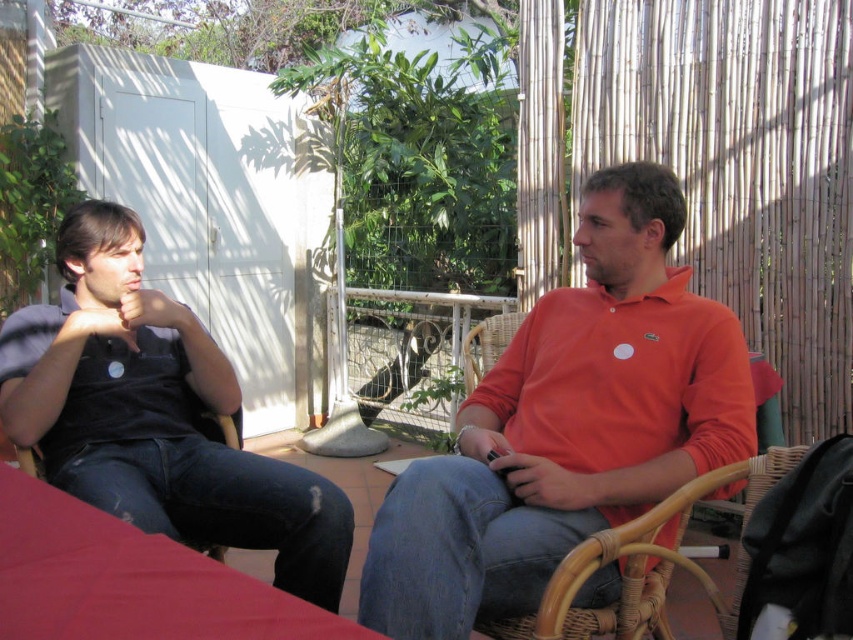
Can you confirm if orange cotton polo shirt at right is positioned to the left of smooth red table at lower left?

No, orange cotton polo shirt at right is not to the left of smooth red table at lower left.

Which is below, orange cotton polo shirt at right or smooth red table at lower left?

smooth red table at lower left is lower down.

This screenshot has height=640, width=853. In order to click on orange cotton polo shirt at right in this screenshot , I will do `click(567, 424)`.

Is smooth red table at lower left above woven rattan chair at right?

Yes, smooth red table at lower left is above woven rattan chair at right.

Is point (28, 540) farther from camera compared to point (711, 593)?

No, it is in front of (711, 593).

At what (x,y) coordinates should I click in order to perform the action: click on smooth red table at lower left. Please return your answer as a coordinate pair (x, y). Looking at the image, I should click on (128, 580).

Locate an element on the screen. The width and height of the screenshot is (853, 640). smooth red table at lower left is located at coordinates (128, 580).

Is point (53, 435) farther from camera compared to point (18, 448)?

Yes, point (53, 435) is farther from viewer.

Between dark blue denim jeans at left and brown woven chair at left, which one appears on the right side from the viewer's perspective?

Positioned to the right is dark blue denim jeans at left.

What do you see at coordinates (155, 413) in the screenshot? This screenshot has width=853, height=640. I see `dark blue denim jeans at left` at bounding box center [155, 413].

The width and height of the screenshot is (853, 640). In order to click on dark blue denim jeans at left in this screenshot , I will do `click(155, 413)`.